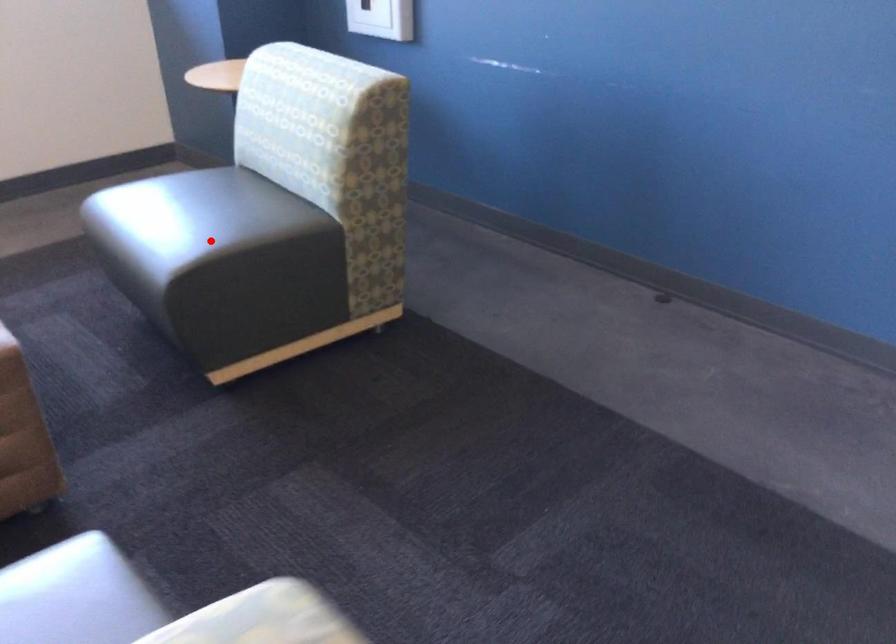
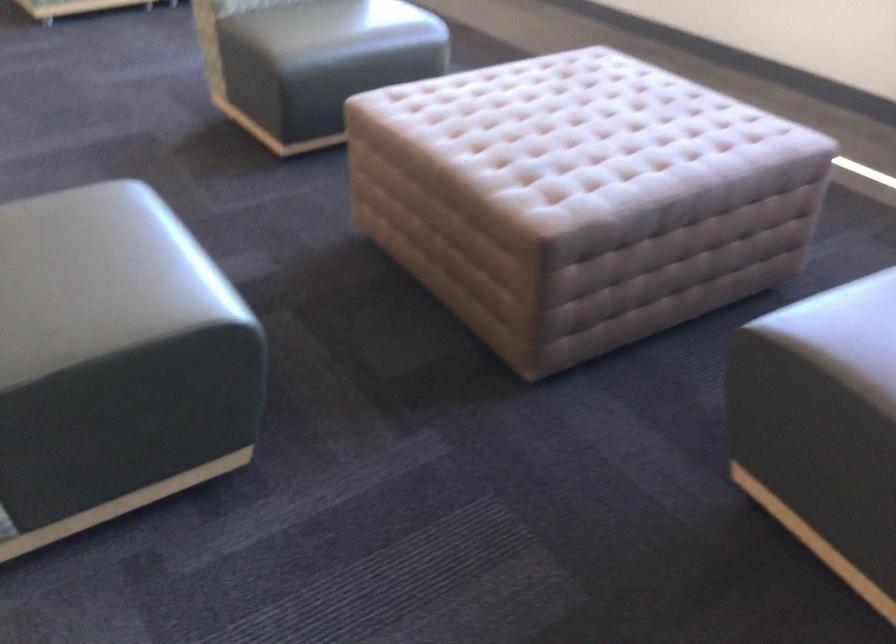
Question: I am providing you with two images of the same scene from different viewpoints. A red point is shown in image1. For the corresponding object point in image2, is it positioned nearer or farther from the camera?

Choices:
 (A) Nearer
 (B) Farther

Answer: (A)